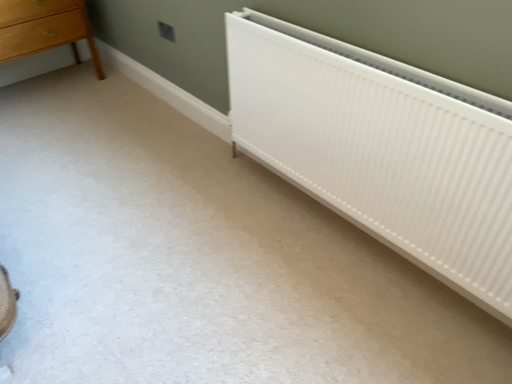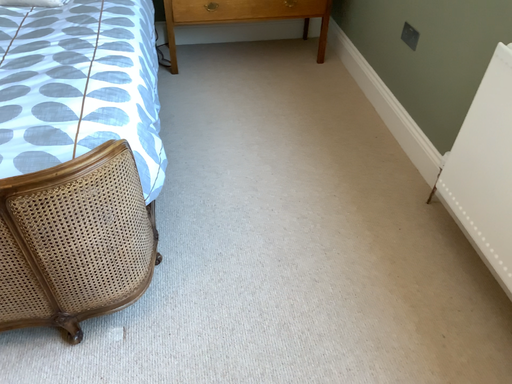
Question: How did the camera likely rotate when shooting the video?

Choices:
 (A) rotated left
 (B) rotated right

Answer: (A)